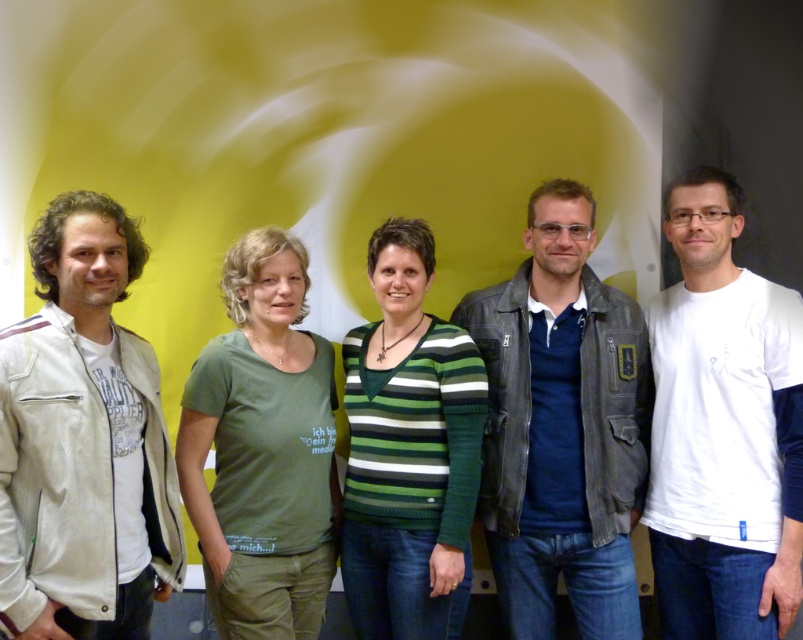
Does white cotton jacket at left lie in front of white matte t-shirt at right?

Yes.

Between white cotton jacket at left and white matte t-shirt at right, which one is positioned higher?

white cotton jacket at left

Is point (56, 307) closer to viewer compared to point (793, 557)?

Yes, it is in front of point (793, 557).

The width and height of the screenshot is (803, 640). Identify the location of white cotton jacket at left. (84, 442).

Identify the location of white cotton jacket at left. (84, 442).

Does green cotton t-shirt at center have a smaller size compared to green striped sweater at center?

Incorrect, green cotton t-shirt at center is not smaller in size than green striped sweater at center.

Is green cotton t-shirt at center positioned in front of green striped sweater at center?

Yes, it is in front of green striped sweater at center.

Is point (298, 419) positioned in front of point (434, 500)?

Yes.

Identify the location of green cotton t-shirt at center. This screenshot has height=640, width=803. (263, 449).